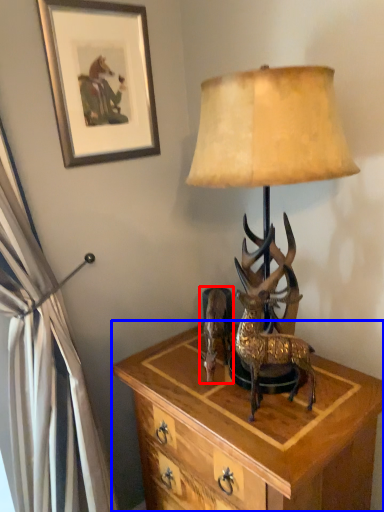
Question: Which object appears farthest to the camera in this image, reindeer (highlighted by a red box) or nightstand (highlighted by a blue box)?

Choices:
 (A) reindeer
 (B) nightstand

Answer: (A)